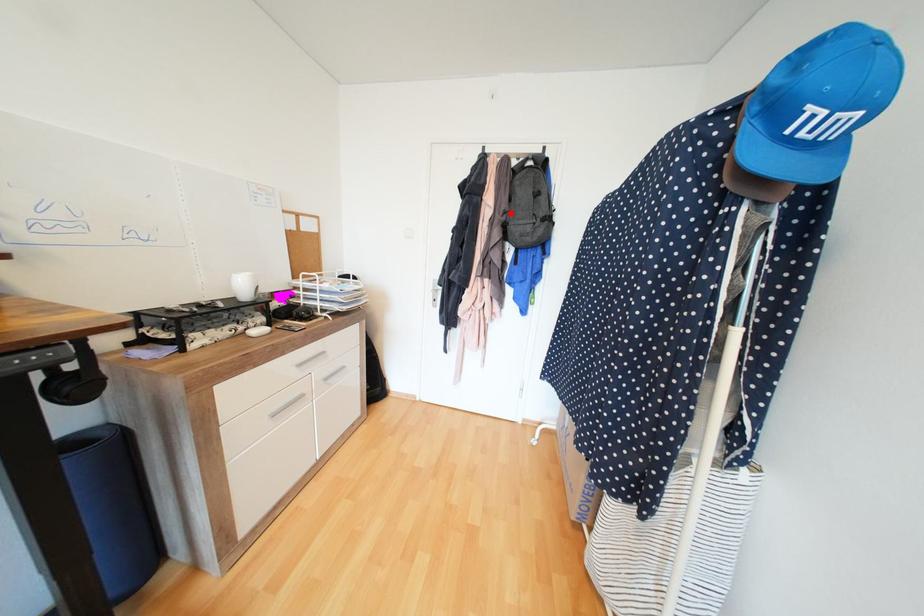
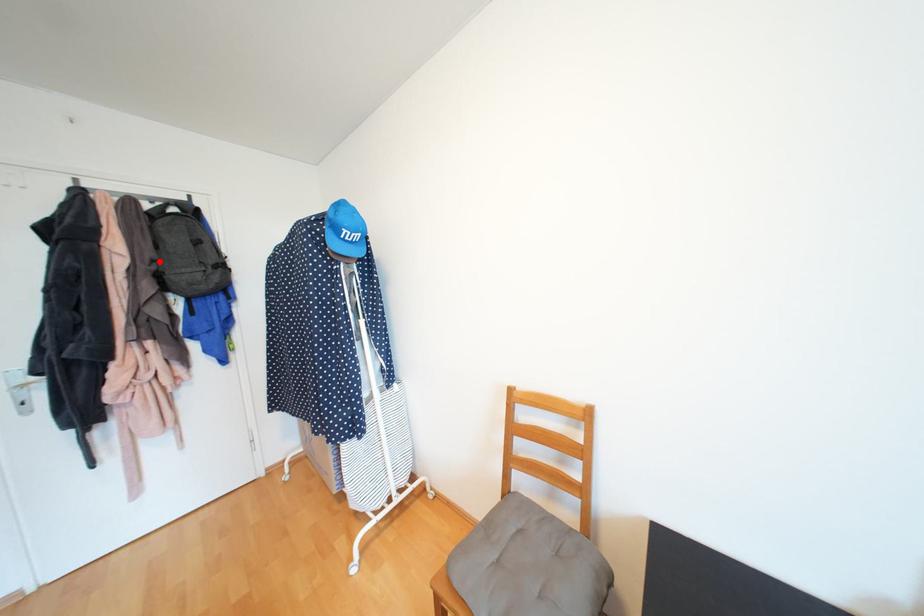
I am providing you with two images of the same scene from different viewpoints. A red point is marked on the first image and another point is marked on the second image. Is the marked point in image1 the same physical position as the marked point in image2?

Yes